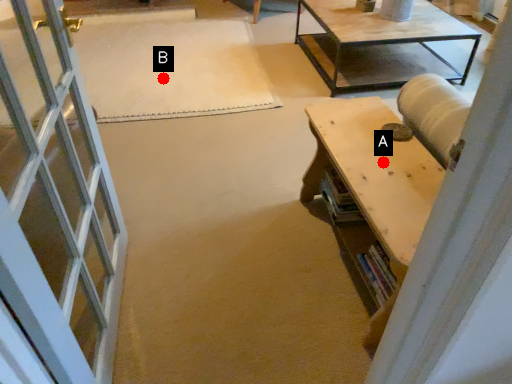
Question: Two points are circled on the image, labeled by A and B beside each circle. Which point is closer to the camera taking this photo?

Choices:
 (A) A is closer
 (B) B is closer

Answer: (A)